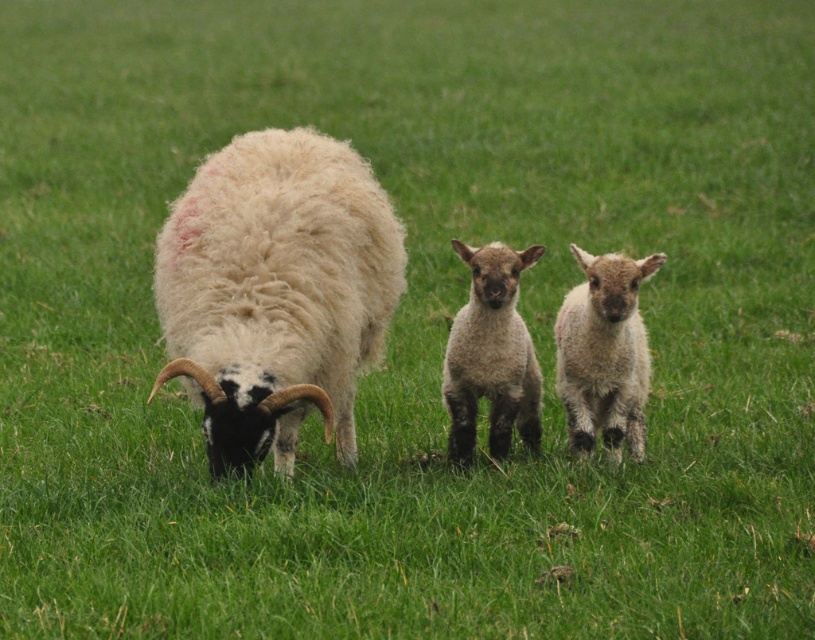
Is fuzzy woolen sheep at center to the left of light brown woolly lamb at center from the viewer's perspective?

Yes, fuzzy woolen sheep at center is to the left of light brown woolly lamb at center.

Which is above, fuzzy woolen sheep at center or light brown woolly lamb at center?

Positioned higher is fuzzy woolen sheep at center.

Between point (245, 156) and point (496, 419), which one is positioned in front?

Positioned in front is point (245, 156).

The width and height of the screenshot is (815, 640). What are the coordinates of `fuzzy woolen sheep at center` in the screenshot? It's located at (276, 291).

The width and height of the screenshot is (815, 640). What are the coordinates of `fuzzy woolen sheep at center` in the screenshot? It's located at tap(276, 291).

Which is behind, point (311, 237) or point (641, 381)?

The point (641, 381) is more distant.

Locate an element on the screen. This screenshot has width=815, height=640. fuzzy woolen sheep at center is located at coordinates (276, 291).

Is point (606, 259) closer to camera compared to point (489, 364)?

Yes.

Does point (591, 288) come closer to viewer compared to point (452, 371)?

Yes.

Where is `fuzzy white lamb at center`? fuzzy white lamb at center is located at coordinates (604, 355).